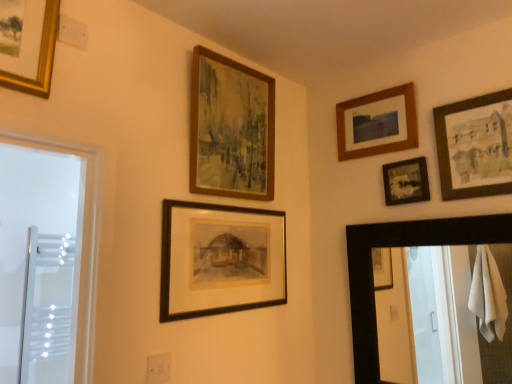
The image size is (512, 384). What are the coordinates of `wooden framed painting at upper right, which ranks as the 1th picture frame in right-to-left order` in the screenshot? It's located at (475, 146).

This screenshot has width=512, height=384. Identify the location of black wooden mirror at right. (402, 246).

How much space does matte black picture frame at center, the 1th picture frame viewed from the left, occupy horizontally?

1.61 inches.

Describe the element at coordinates (406, 181) in the screenshot. This screenshot has width=512, height=384. I see `matte black picture frame at upper right, which appears as the 2th picture frame when viewed from the right` at that location.

What is the approximate width of matte black picture frame at upper right, which is the fourth picture frame from left to right?

The width of matte black picture frame at upper right, which is the fourth picture frame from left to right, is 1.31 inches.

Where is `wooden frame at upper right, marked as the 3th picture frame in a left-to-right arrangement`? This screenshot has width=512, height=384. wooden frame at upper right, marked as the 3th picture frame in a left-to-right arrangement is located at coordinates (377, 123).

Which of these two, wooden frame at upper right, marked as the 3th picture frame in a left-to-right arrangement, or wooden framed painting at upper right, marked as the fifth picture frame in a left-to-right arrangement, stands taller?

wooden framed painting at upper right, marked as the fifth picture frame in a left-to-right arrangement, is taller.

Is wooden frame at upper right, marked as the 3th picture frame in a left-to-right arrangement, completely or partially outside of wooden framed painting at upper right, which ranks as the 1th picture frame in right-to-left order?

Yes.

Is wooden frame at upper right, arranged as the 3th picture frame when viewed from the right, far from wooden framed painting at upper right, which ranks as the 1th picture frame in right-to-left order?

They are positioned close to each other.

From the picture: Are black wooden mirror at right and transparent glass screen door at left beside each other?

There is a gap between black wooden mirror at right and transparent glass screen door at left.

Based on the photo, from a real-world perspective, who is located higher, black wooden mirror at right or transparent glass screen door at left?

From a 3D spatial view, transparent glass screen door at left is above.

Does point (426, 233) come in front of point (40, 374)?

Yes, it is.

Is wooden frame at upper right, marked as the 3th picture frame in a left-to-right arrangement, a part of transparent glass screen door at left?

No.

From the image's perspective, who appears lower, transparent glass screen door at left or wooden frame at upper right, arranged as the 3th picture frame when viewed from the right?

transparent glass screen door at left is shown below in the image.

Is point (62, 279) closer or farther from the camera than point (417, 144)?

Point (62, 279) appears to be farther away from the viewer than point (417, 144).

Which is behind, point (198, 70) or point (499, 100)?

Positioned behind is point (198, 70).

From a real-world perspective, is wooden-framed painting at upper center, the 4th picture frame when ordered from right to left, positioned under wooden framed painting at upper right, marked as the fifth picture frame in a left-to-right arrangement, based on gravity?

No, from a real-world perspective, wooden-framed painting at upper center, the 4th picture frame when ordered from right to left, is not beneath wooden framed painting at upper right, marked as the fifth picture frame in a left-to-right arrangement.

Would you say wooden-framed painting at upper center, which appears as the 2th picture frame when viewed from the left, contains wooden framed painting at upper right, marked as the fifth picture frame in a left-to-right arrangement?

No, wooden framed painting at upper right, marked as the fifth picture frame in a left-to-right arrangement, is not inside wooden-framed painting at upper center, which appears as the 2th picture frame when viewed from the left.

From a real-world perspective, which picture frame is the 1st one above the wooden framed painting at upper right, which ranks as the 1th picture frame in right-to-left order? Please provide its 2D coordinates.

[(231, 128)]

Based on the photo, is black wooden mirror at right taller than matte black picture frame at center, the fifth picture frame when ordered from right to left?

Indeed, black wooden mirror at right has a greater height compared to matte black picture frame at center, the fifth picture frame when ordered from right to left.

Considering the relative sizes of black wooden mirror at right and matte black picture frame at center, the fifth picture frame when ordered from right to left, in the image provided, is black wooden mirror at right thinner than matte black picture frame at center, the fifth picture frame when ordered from right to left,?

In fact, black wooden mirror at right might be wider than matte black picture frame at center, the fifth picture frame when ordered from right to left.

From the image's perspective, which one is positioned lower, black wooden mirror at right or matte black picture frame at center, the 1th picture frame viewed from the left?

black wooden mirror at right.

Is black wooden mirror at right looking in the opposite direction of matte black picture frame at center, the 1th picture frame viewed from the left?

That's not correct — black wooden mirror at right is not looking away from matte black picture frame at center, the 1th picture frame viewed from the left.

Between wooden-framed painting at upper center, the 4th picture frame when ordered from right to left, and matte black picture frame at center, the 1th picture frame viewed from the left, which one is positioned behind?

Positioned behind is wooden-framed painting at upper center, the 4th picture frame when ordered from right to left.

Is wooden-framed painting at upper center, which appears as the 2th picture frame when viewed from the left, not near matte black picture frame at center, the 1th picture frame viewed from the left?

No, there isn't a large distance between wooden-framed painting at upper center, which appears as the 2th picture frame when viewed from the left, and matte black picture frame at center, the 1th picture frame viewed from the left.

Between wooden-framed painting at upper center, which appears as the 2th picture frame when viewed from the left, and matte black picture frame at center, the 1th picture frame viewed from the left, which one has larger size?

wooden-framed painting at upper center, which appears as the 2th picture frame when viewed from the left, is bigger.

In the scene shown: From a real-world perspective, which object stands above the other?

wooden-framed painting at upper center, the 4th picture frame when ordered from right to left.

Find the location of a particular element. The height and width of the screenshot is (384, 512). mirror beneath the transparent glass screen door at left (from a real-world perspective) is located at coordinates (402, 246).

How many degrees apart are the facing directions of transparent glass screen door at left and black wooden mirror at right?

89.1 degrees.

Considering the relative positions of transparent glass screen door at left and black wooden mirror at right in the image provided, is transparent glass screen door at left behind black wooden mirror at right?

Yes, transparent glass screen door at left is further from the camera.

This screenshot has width=512, height=384. In order to click on the 2nd picture frame below the wooden frame at upper right, marked as the 3th picture frame in a left-to-right arrangement (from a real-world perspective) in this screenshot , I will do `click(475, 146)`.

Locate an element on the screen. This screenshot has width=512, height=384. screen door above the black wooden mirror at right (from a real-world perspective) is located at coordinates (47, 307).

When comparing their distances from wooden frame at upper right, marked as the 3th picture frame in a left-to-right arrangement, does black wooden mirror at right or matte black picture frame at upper right, which is the fourth picture frame from left to right, seem closer?

matte black picture frame at upper right, which is the fourth picture frame from left to right, lies closer to wooden frame at upper right, marked as the 3th picture frame in a left-to-right arrangement, than the other object.

When comparing their distances from matte black picture frame at center, the fifth picture frame when ordered from right to left, does wooden frame at upper right, arranged as the 3th picture frame when viewed from the right, or matte black picture frame at upper right, which is the fourth picture frame from left to right, seem further?

matte black picture frame at upper right, which is the fourth picture frame from left to right, is further to matte black picture frame at center, the fifth picture frame when ordered from right to left.

When comparing their distances from wooden-framed painting at upper center, which appears as the 2th picture frame when viewed from the left, does transparent glass screen door at left or black wooden mirror at right seem further?

transparent glass screen door at left.

From the image, which object appears to be farther from matte black picture frame at center, the 1th picture frame viewed from the left, wooden-framed painting at upper center, the 4th picture frame when ordered from right to left, or matte black picture frame at upper right, which is the fourth picture frame from left to right?

matte black picture frame at upper right, which is the fourth picture frame from left to right, is further to matte black picture frame at center, the 1th picture frame viewed from the left.

Considering their positions, is transparent glass screen door at left positioned closer to wooden frame at upper right, arranged as the 3th picture frame when viewed from the right, than black wooden mirror at right?

black wooden mirror at right is closer to wooden frame at upper right, arranged as the 3th picture frame when viewed from the right.

Based on their spatial positions, is matte black picture frame at upper right, which is the fourth picture frame from left to right, or transparent glass screen door at left further from wooden frame at upper right, marked as the 3th picture frame in a left-to-right arrangement?

Among the two, transparent glass screen door at left is located further to wooden frame at upper right, marked as the 3th picture frame in a left-to-right arrangement.

Consider the image. From the image, which object appears to be nearer to transparent glass screen door at left, wooden framed painting at upper right, marked as the fifth picture frame in a left-to-right arrangement, or wooden-framed painting at upper center, the 4th picture frame when ordered from right to left?

wooden-framed painting at upper center, the 4th picture frame when ordered from right to left.

Which object lies nearer to the anchor point black wooden mirror at right, matte black picture frame at center, the 1th picture frame viewed from the left, or matte black picture frame at upper right, which is the fourth picture frame from left to right?

Among the two, matte black picture frame at upper right, which is the fourth picture frame from left to right, is located nearer to black wooden mirror at right.

What are the coordinates of `mirror located between matte black picture frame at center, the fifth picture frame when ordered from right to left, and wooden framed painting at upper right, marked as the fifth picture frame in a left-to-right arrangement, in the left-right direction` in the screenshot? It's located at (402, 246).

This screenshot has width=512, height=384. I want to click on picture frame located between transparent glass screen door at left and wooden-framed painting at upper center, the 4th picture frame when ordered from right to left, in the left-right direction, so click(x=220, y=259).

What are the coordinates of `mirror between wooden-framed painting at upper center, the 4th picture frame when ordered from right to left, and wooden framed painting at upper right, marked as the fifth picture frame in a left-to-right arrangement, from left to right` in the screenshot? It's located at (402, 246).

The height and width of the screenshot is (384, 512). Find the location of `mirror between transparent glass screen door at left and wooden framed painting at upper right, which ranks as the 1th picture frame in right-to-left order, in the horizontal direction`. mirror between transparent glass screen door at left and wooden framed painting at upper right, which ranks as the 1th picture frame in right-to-left order, in the horizontal direction is located at coordinates (402, 246).